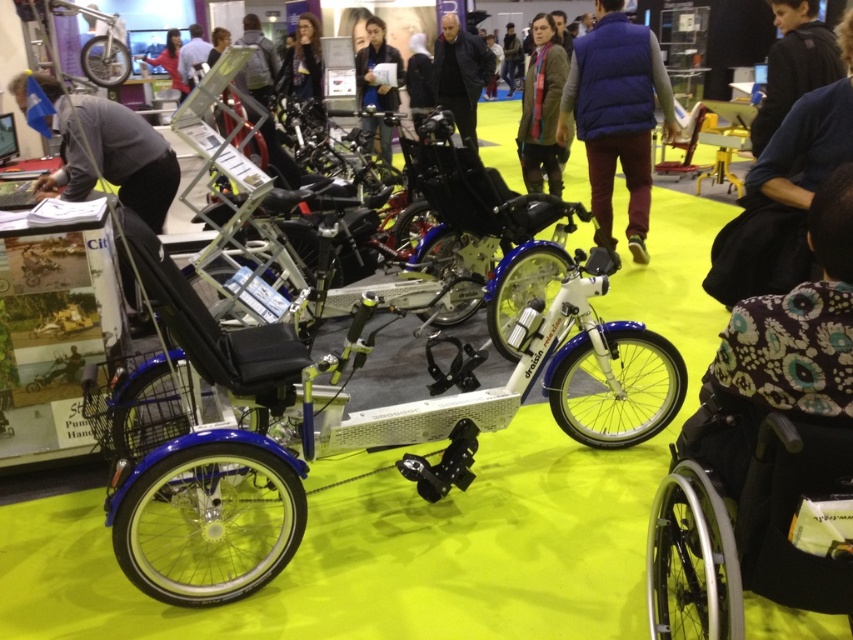
You are attending a trade show and want to take a closer look at the dark blue jacket at center displayed in the exhibition. The exhibition hall has a strict rule that visitors must stay at least 6 meters away from all displayed items for safety. Can you safely approach the jacket without violating the rule?

The dark blue jacket at center is 6.32 meters away from the camera, so you can approach it to within 6 meters and still comply with the rule since 6.32 meters is greater than the required 6 meters distance.

You are an event organizer at the exhibition and need to place a large banner between the gray fabric at left and the dark brown leather jacket at center. Which object should the banner be placed closer to to ensure it doesn

The gray fabric at left is bigger than the dark brown leather jacket at center, so placing the banner closer to the gray fabric at left would ensure it is visible and appropriately scaled.

Looking at this image, you are at the entrance of the exhibition and want to move towards the specialized tricycle in the foreground. There is a black plastic wheelchair at lower right in your path. Can you navigate around it without obstacles?

The black plastic wheelchair at lower right is located at point (x=744, y=524), so yes, you can navigate around it as long as there are no other obstacles in your path.